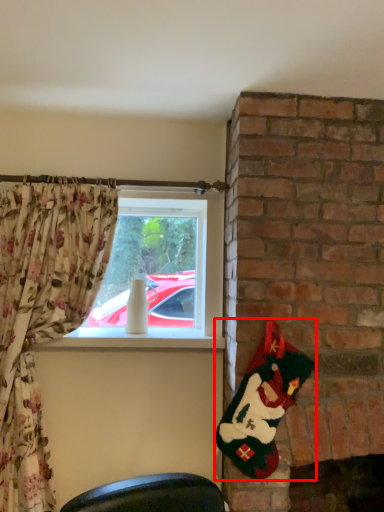
Question: Considering the relative positions of santa claus (annotated by the red box) and window in the image provided, where is santa claus (annotated by the red box) located with respect to the staircase?

Choices:
 (A) left
 (B) right

Answer: (B)